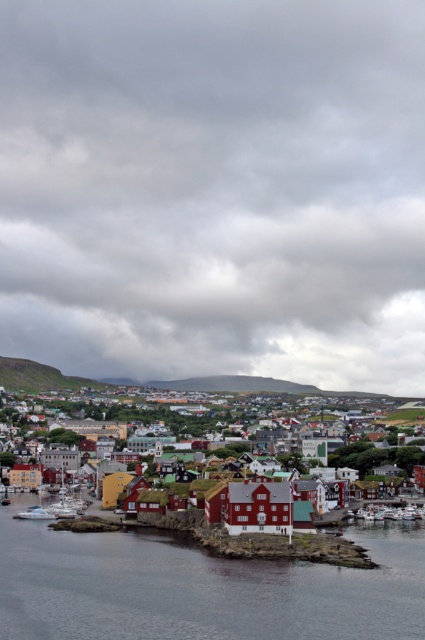
You are a tourist standing at the edge of the coastal town and want to take a photo that includes both the smooth water at lower center and the green grassy hillside at upper left. Based on their positions, which object should you adjust your camera to focus on first to ensure both are in the frame?

The smooth water at lower center is to the right of the green grassy hillside at upper left, so you should focus on the green grassy hillside at upper left first to ensure both are included in the frame.

You are standing at point A in the coastal town and want to reach the smooth water at lower center. According to the map coordinates, your current position is at point B which is at point (201, 588). Is the smooth water at lower center located north or south of your current position?

The smooth water at lower center is located at point (201, 588), which is your current position. Therefore, you are already at the smooth water at lower center.

You are a tourist standing at the edge of the water in this coastal town. You want to find the green grassy hillside at upper left. According to the map, there is a marked point at coordinates point (39, 376). Which direction should you look to find the green grassy hillside at upper left?

The point (39, 376) marks the green grassy hillside at upper left, so you should look towards the upper left direction to find it.